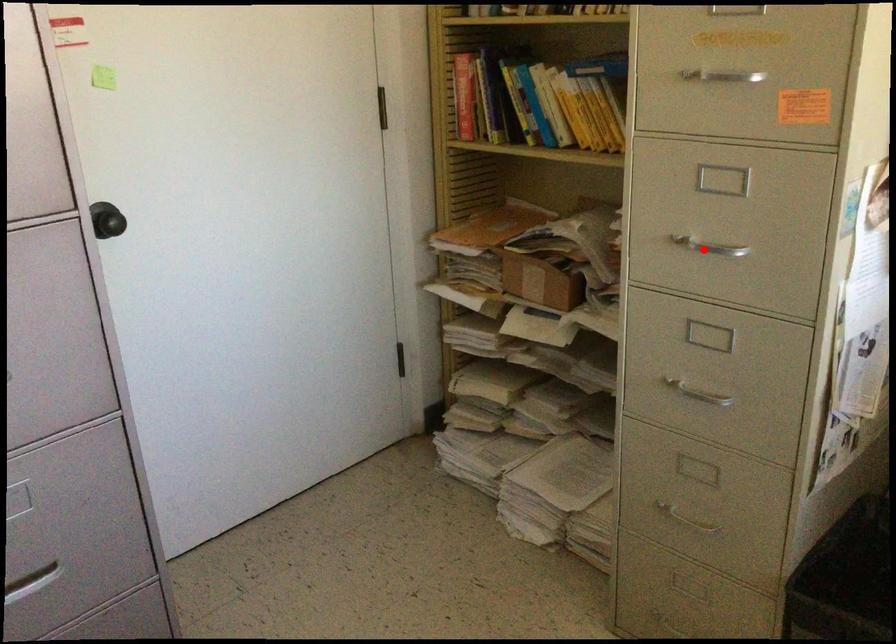
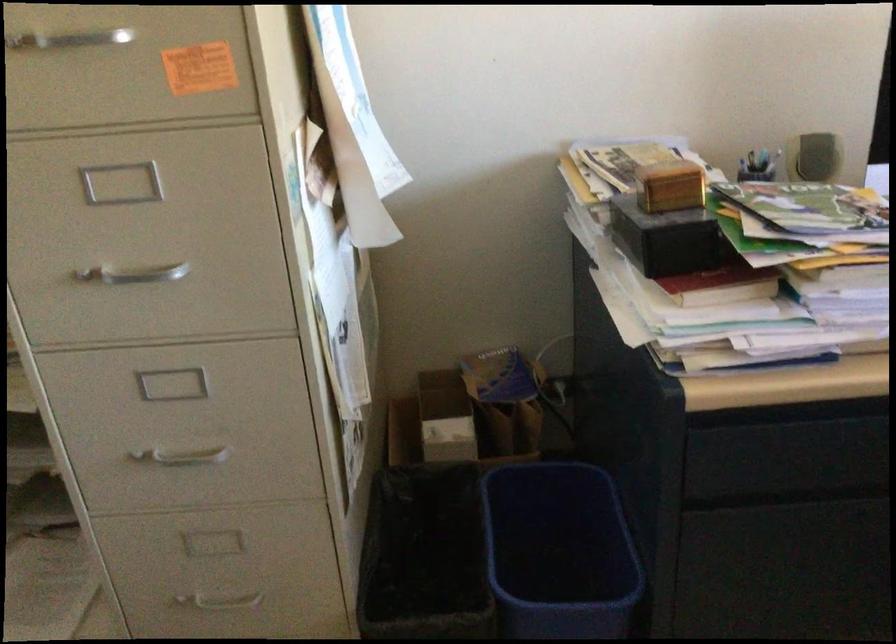
The point at the highlighted location is marked in the first image. Where is the corresponding point in the second image?

(134, 274)